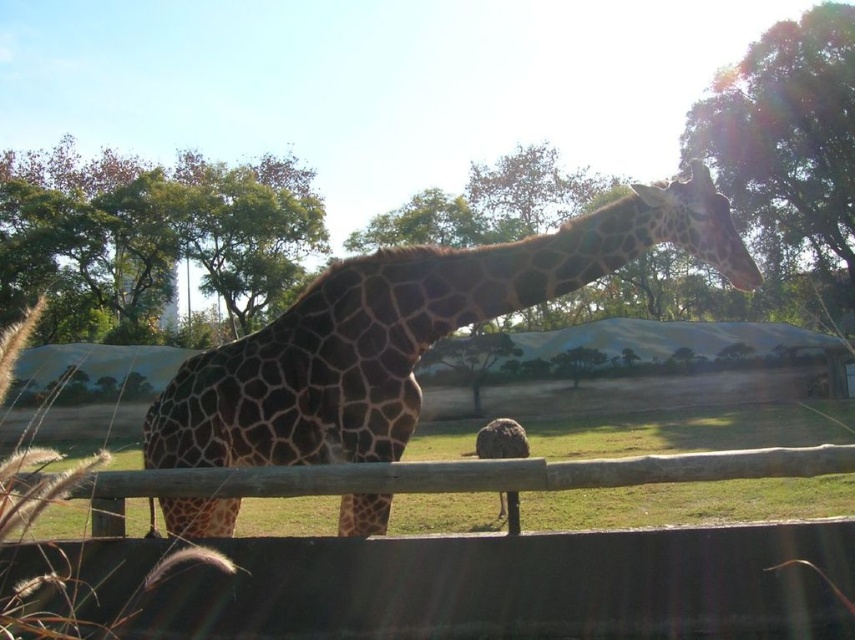
You are a zookeeper standing in front of the enclosure. You see the brown spotted giraffe at center and the wooden fence at center. Which object is closer to the left side of the enclosure?

The brown spotted giraffe at center is closer to the left side of the enclosure than the wooden fence at center.

You are a zookeeper who needs to ensure the giraffe can move freely without getting stuck. Based on the image, is the brown spotted giraffe at center above or below the wooden fence at center?

The brown spotted giraffe at center is positioned over the wooden fence at center, so it is above the fence and can move freely without getting stuck.

You are a zookeeper trying to feed the brown spotted giraffe at center. The wooden fence at center is in your way. Can you reach the giraffe without climbing over the fence?

The brown spotted giraffe at center is further to the viewer than the wooden fence at center, so you can reach it without climbing over the fence because the giraffe is closer to you than the fence.